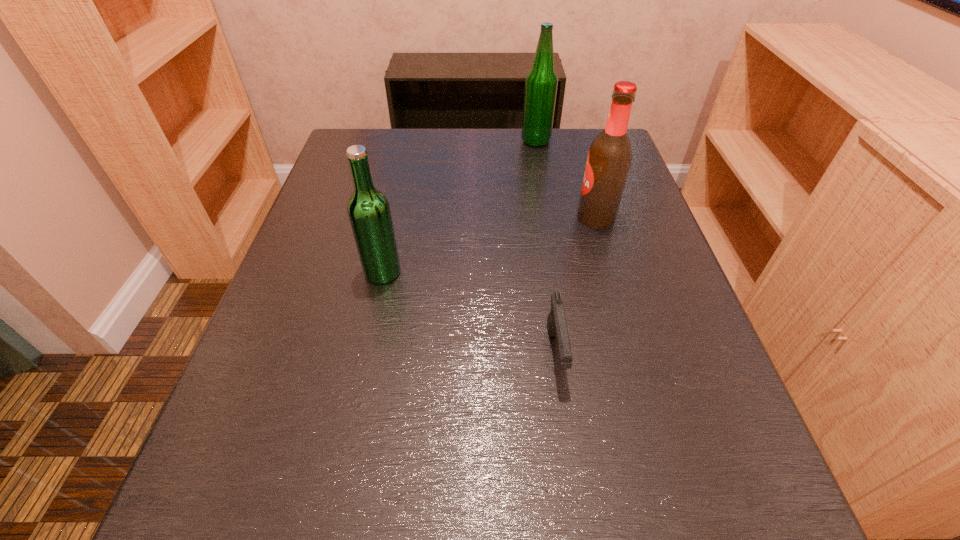
This screenshot has height=540, width=960. In order to click on free space at the far left corner of the desktop in this screenshot , I will do `click(381, 128)`.

You are a GUI agent. You are given a task and a screenshot of the screen. Output one action in this format:
    pyautogui.click(x=<x>, y=<y>)
    Task: Click on the free region at the far right corner of the desktop
    Image resolution: width=960 pixels, height=540 pixels.
    Given the screenshot: What is the action you would take?
    pyautogui.click(x=579, y=163)

This screenshot has width=960, height=540. I want to click on free area in between the second farthest object and the pistol, so click(x=575, y=286).

The image size is (960, 540). Find the location of `vacant space that is in between the farthest object and the nearest object`. vacant space that is in between the farthest object and the nearest object is located at coordinates (545, 247).

Locate an element on the screen. vacant area that lies between the second nearest beer bottle and the farthest object is located at coordinates (565, 179).

At what (x,y) coordinates should I click in order to perform the action: click on vacant area between the second beer bottle from left to right and the rightmost object. Please return your answer as a coordinate pair (x, y). Looking at the image, I should click on (565, 179).

Find the location of a particular element. The width and height of the screenshot is (960, 540). blank region between the rightmost beer bottle and the farthest object is located at coordinates (565, 179).

I want to click on unoccupied position between the farthest beer bottle and the rightmost object, so click(565, 179).

Where is `vacant point located between the third nearest object and the nearest object`? This screenshot has width=960, height=540. vacant point located between the third nearest object and the nearest object is located at coordinates (575, 286).

This screenshot has width=960, height=540. Identify the location of free space that is in between the second farthest beer bottle and the second nearest object. click(x=489, y=245).